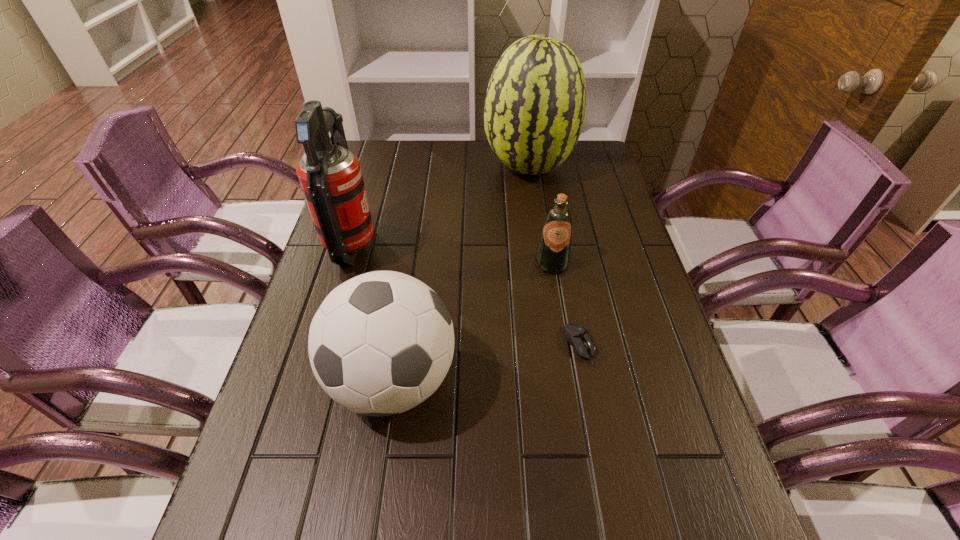
Identify the location of object at the far edge. The height and width of the screenshot is (540, 960). (534, 110).

You are a GUI agent. You are given a task and a screenshot of the screen. Output one action in this format:
    pyautogui.click(x=<x>, y=<y>)
    Task: Click on the fire extinguisher that is at the left edge
    The image size is (960, 540).
    Given the screenshot: What is the action you would take?
    pyautogui.click(x=330, y=175)

Locate an element on the screen. soccer ball located in the left edge section of the desktop is located at coordinates (381, 343).

Locate an element on the screen. The width and height of the screenshot is (960, 540). object that is positioned at the right edge is located at coordinates tap(534, 110).

Identify the location of object that is at the far right corner. point(534,110).

Locate an element on the screen. free space at the far edge is located at coordinates (480, 166).

This screenshot has height=540, width=960. I want to click on free spot at the right edge of the desktop, so click(x=603, y=261).

I want to click on vacant area at the far left corner, so click(374, 160).

In order to click on vacant space at the far right corner of the desktop in this screenshot , I will do `click(582, 153)`.

I want to click on vacant point located between the soccer ball and the shortest object, so click(x=487, y=362).